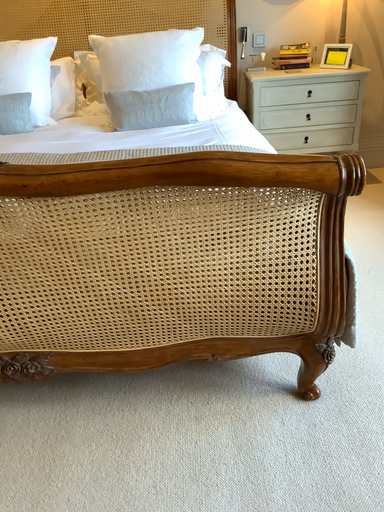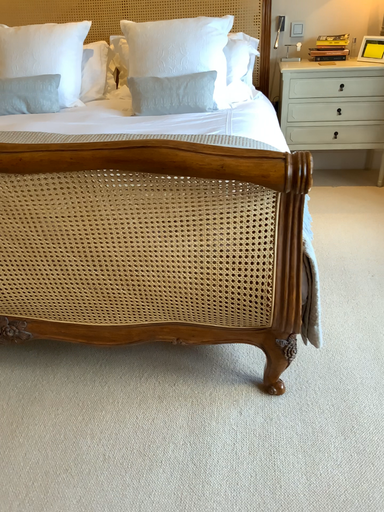
Question: Which way did the camera rotate in the video?

Choices:
 (A) rotated right
 (B) rotated left

Answer: (B)